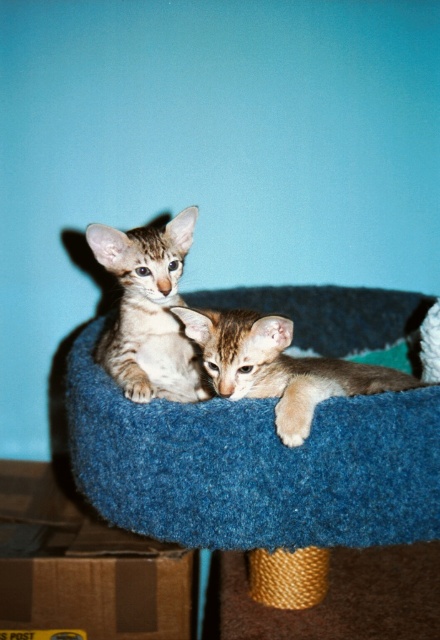
You are a cat owner who wants to place a new toy for your kittens. The toy is 10 cm tall. You have two options to place it either on the brown cardboard box at lower left or on the tabby fur kitten at center. Which location would you choose to ensure the toy won

The brown cardboard box at lower left is much taller than the tabby fur kitten at center, so placing the toy on the brown cardboard box at lower left would be more stable and safer for the kitten.

You are a cat owner who wants to ensure your light brown fur kitten at center has enough space to stretch out on the blue felt cat bed at center. Based on the scene, can the kitten comfortably fit on the bed?

The blue felt cat bed at center is wider than the light brown fur kitten at center, so the kitten can comfortably stretch out on the bed.

You are standing in front of the cat tree where the two kittens are resting. You notice two specific points marked on the image. Which of these points, point (51,561) or point (414,381), is closer to you?

Point (51,561) is closer to the viewer than point (414,381).